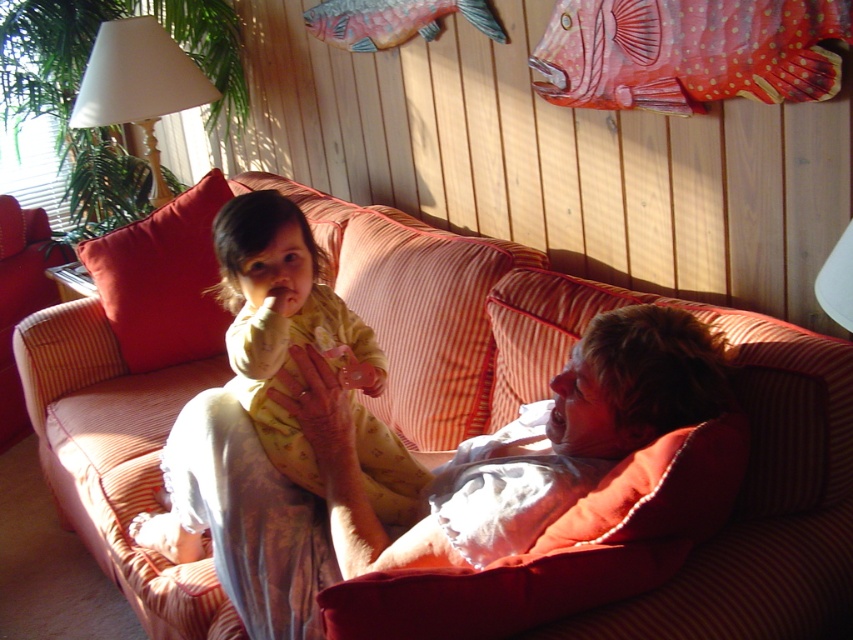
Question: Is the position of yellow/yellowish fabric baby at center less distant than that of red cotton pillow at left?

Choices:
 (A) yes
 (B) no

Answer: (A)

Question: Is striped fabric couch at center thinner than matte white blanket at center?

Choices:
 (A) yes
 (B) no

Answer: (B)

Question: Which object is the closest to the matte white blanket at center?

Choices:
 (A) yellow/yellowish fabric baby at center
 (B) red cotton pillow at left
 (C) striped fabric couch at center
 (D) white fabric lampshade at upper left

Answer: (A)

Question: Does striped fabric couch at center have a smaller size compared to yellow/yellowish fabric baby at center?

Choices:
 (A) yes
 (B) no

Answer: (B)

Question: Which point is farther from the camera taking this photo?

Choices:
 (A) (294, 534)
 (B) (189, 262)
 (C) (155, 145)
 (D) (714, 506)

Answer: (C)

Question: Which of the following is the closest to the observer?

Choices:
 (A) striped fabric couch at center
 (B) white fabric lampshade at upper left
 (C) red cotton pillow at left
 (D) matte white blanket at center

Answer: (A)